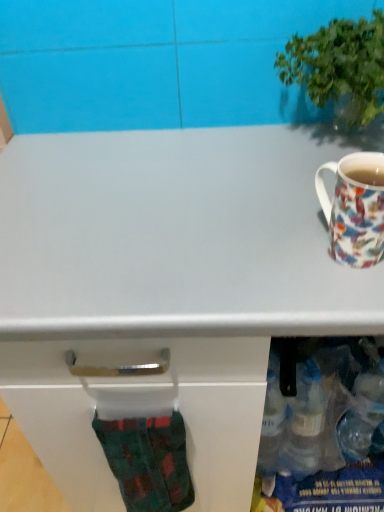
The width and height of the screenshot is (384, 512). In order to click on vacant location behind porcelain floral mug at right in this screenshot , I will do `click(278, 180)`.